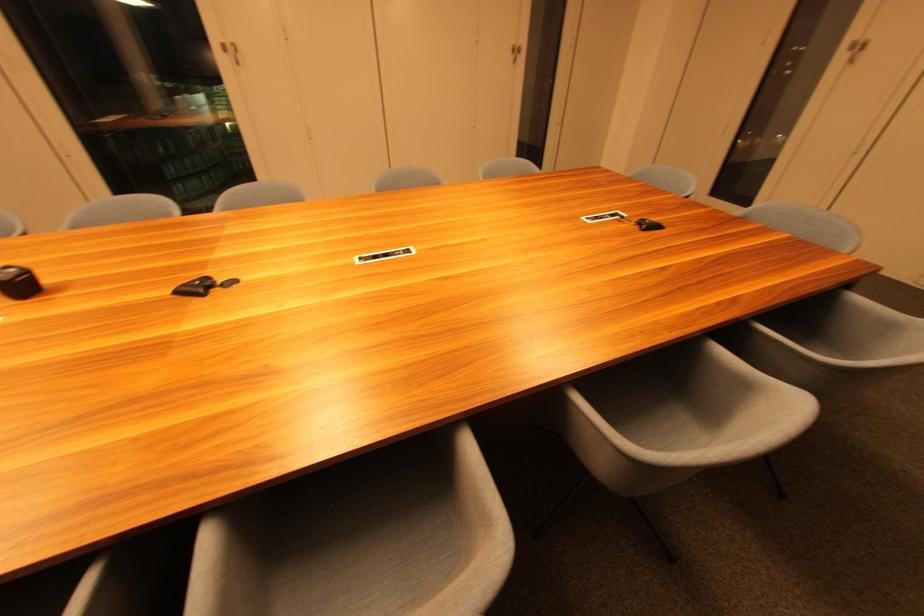
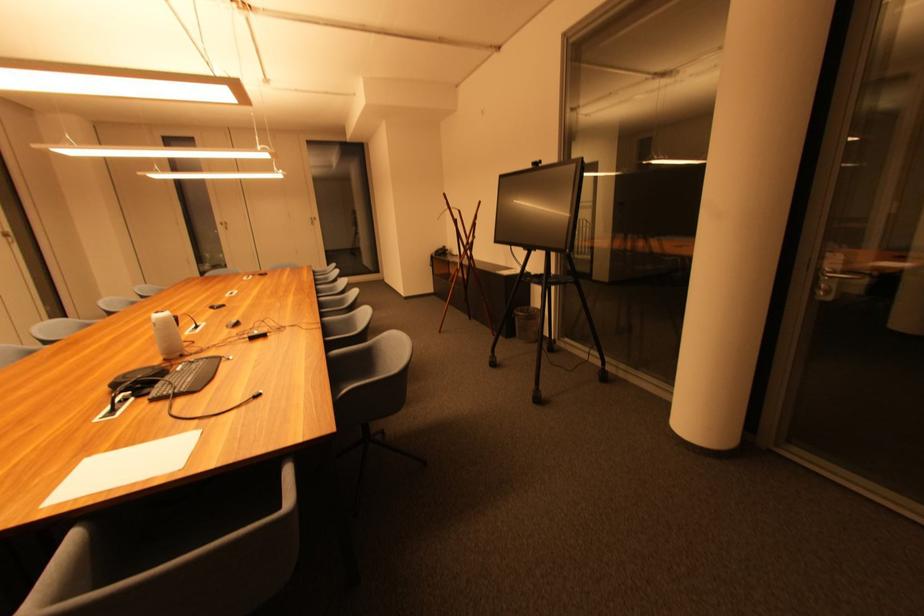
The point at (857, 47) is marked in the first image. Where is the corresponding point in the second image?

(226, 225)